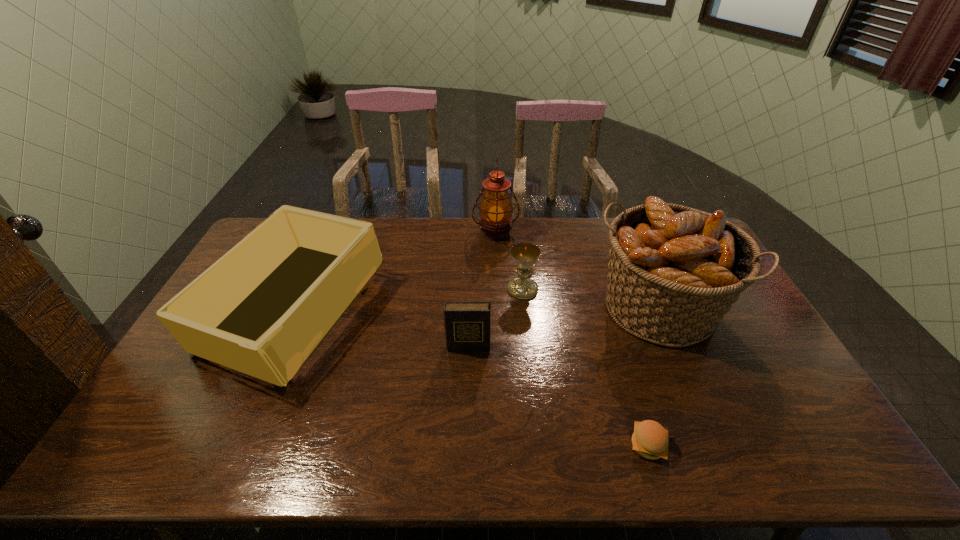
At what (x,y) coordinates should I click in order to perform the action: click on blank space at the far edge of the desktop. Please return your answer as a coordinate pair (x, y). Image resolution: width=960 pixels, height=540 pixels. Looking at the image, I should click on point(480,244).

Locate an element on the screen. vacant space at the near edge of the desktop is located at coordinates (327, 444).

What are the coordinates of `vacant region at the right edge` in the screenshot? It's located at (759, 413).

I want to click on free space between the chalice and the farthest object, so click(509, 261).

Find the location of `free space between the oil lamp and the diary`. free space between the oil lamp and the diary is located at coordinates (482, 290).

Where is `free space between the basket and the chalice`? This screenshot has width=960, height=540. free space between the basket and the chalice is located at coordinates (590, 299).

Locate an element on the screen. Image resolution: width=960 pixels, height=540 pixels. vacant point located between the shortest object and the leftmost object is located at coordinates (470, 379).

The image size is (960, 540). What are the coordinates of `blank region between the chalice and the farthest object` in the screenshot? It's located at (509, 261).

Identify the location of vacant point located between the basket and the chalice. Image resolution: width=960 pixels, height=540 pixels. (x=590, y=299).

Identify the location of blank region between the chalice and the hamburger. (586, 367).